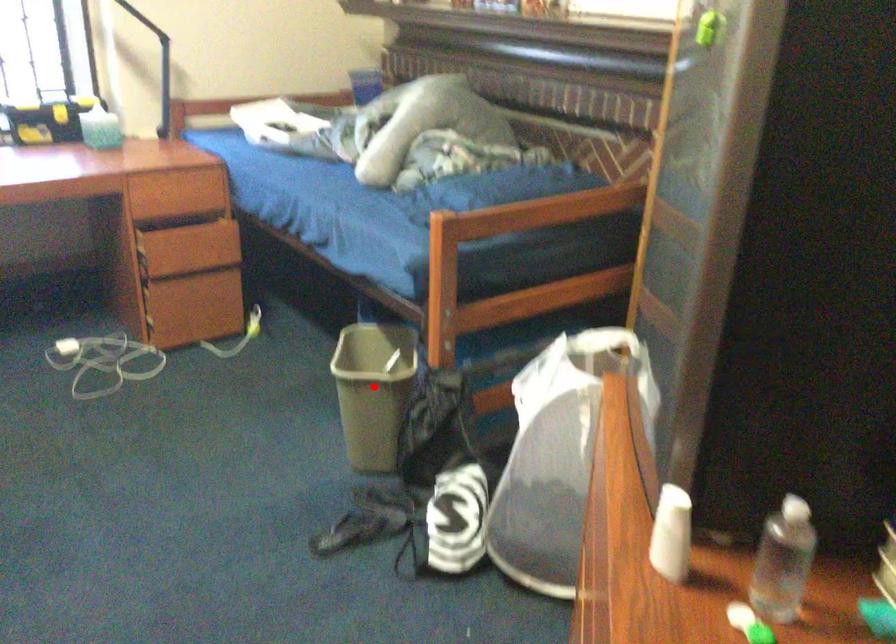
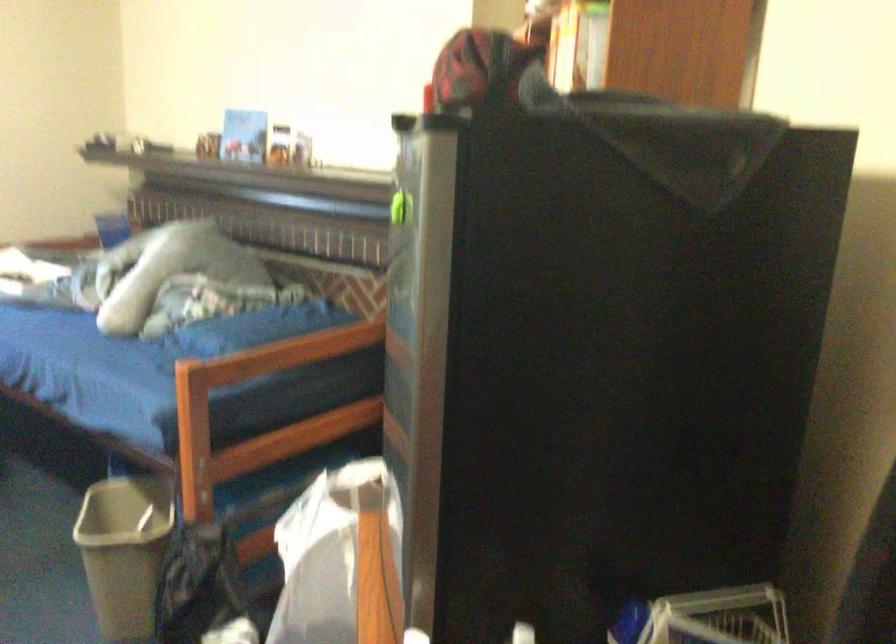
Find the pixel in the second image that matches the highlighted location in the first image.

(124, 552)